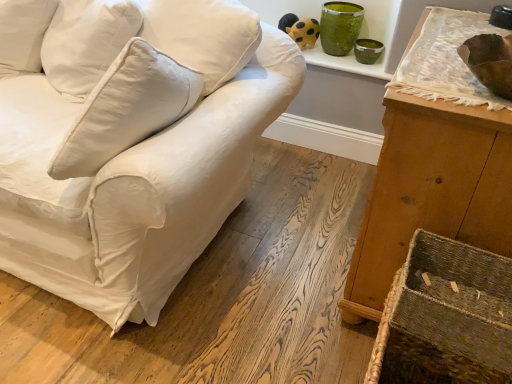
Question: In the image, is yellow matte plush toy at upper center positioned in front of or behind rustic woven basket at lower right?

Choices:
 (A) front
 (B) behind

Answer: (B)

Question: In terms of width, does yellow matte plush toy at upper center look wider or thinner when compared to rustic woven basket at lower right?

Choices:
 (A) thin
 (B) wide

Answer: (A)

Question: Which object is the closest to the green glass vase at upper right?

Choices:
 (A) wooden cabinet at right
 (B) yellow matte plush toy at upper center
 (C) rustic woven basket at lower right
 (D) white cotton couch at center

Answer: (B)

Question: Which is nearer to the rustic woven basket at lower right?

Choices:
 (A) yellow matte plush toy at upper center
 (B) green glass vase at upper right
 (C) wooden cabinet at right
 (D) white cotton couch at center

Answer: (C)